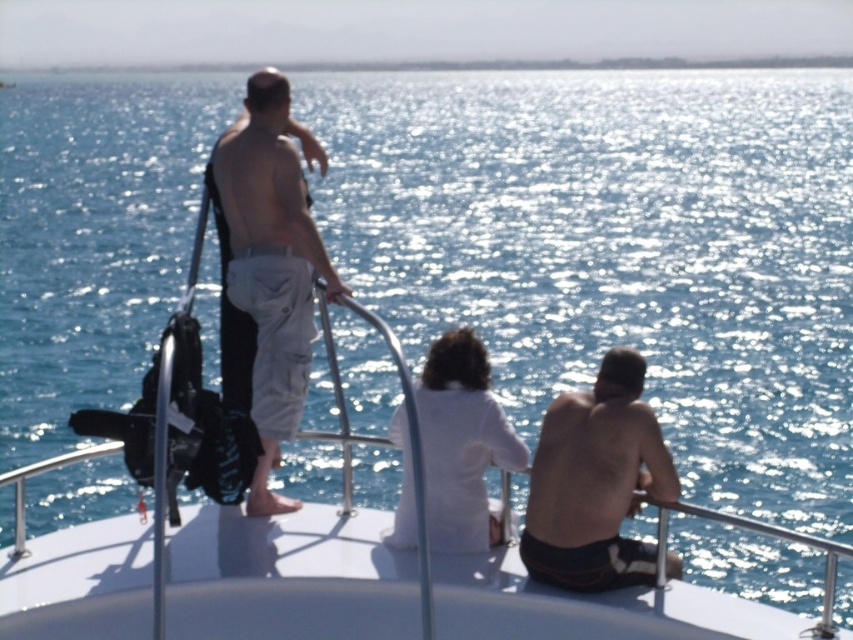
Consider the image. You are a photographer on the boat deck. You want to take a photo of the light gray cotton shorts at center and the white cotton shirt at center. Which one is taller in the photo?

The light gray cotton shorts at center is taller than the white cotton shirt at center in the photo.

Consider the image. You are standing on the boat deck and want to take a photo of the light gray cotton shorts at center using the camera. Can you do this without moving either the shorts or the camera?

The light gray cotton shorts at center and camera are 54.50 feet apart, so yes, you can take the photo without moving either since the distance is sufficient for a camera to capture the image from that distance.

You are a photographer on the boat deck. You want to take a photo of the light gray cotton shorts at center and the smooth skin torso at right. Which one is positioned higher in the frame?

The light gray clothing at center is above the smooth skin torso at right, so it will appear higher in the photo.